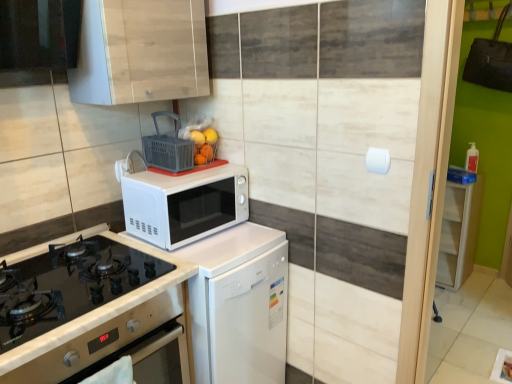
The height and width of the screenshot is (384, 512). Find the location of `plastic basket at upper center`. plastic basket at upper center is located at coordinates (168, 148).

What do you see at coordinates (68, 285) in the screenshot? The width and height of the screenshot is (512, 384). I see `black glass gas stove at lower left` at bounding box center [68, 285].

In order to face black glass exhaust hood at upper left, should I rotate leftwards or rightwards?

To align with it, rotate left about 28.054°.

Image resolution: width=512 pixels, height=384 pixels. What do you see at coordinates (37, 39) in the screenshot? I see `black glass exhaust hood at upper left` at bounding box center [37, 39].

The width and height of the screenshot is (512, 384). Describe the element at coordinates (140, 52) in the screenshot. I see `wooden cabinet at upper center, positioned as the 2th cabinetry in right-to-left order` at that location.

Measure the distance between wooden cabinet at upper center, which ranks as the second cabinetry in back-to-front order, and camera.

The depth of wooden cabinet at upper center, which ranks as the second cabinetry in back-to-front order, is 1.36 meters.

Where is `plastic basket at upper center`? This screenshot has height=384, width=512. plastic basket at upper center is located at coordinates (168, 148).

From a real-world perspective, which object stands above the other?

plastic basket at upper center.

Is white plastic electric outlet at upper center far away from plastic basket at upper center?

No, there isn't a large distance between white plastic electric outlet at upper center and plastic basket at upper center.

Can you tell me how much white plastic electric outlet at upper center and plastic basket at upper center differ in facing direction?

The angular difference between white plastic electric outlet at upper center and plastic basket at upper center is 4.36 degrees.

Can you confirm if white plastic electric outlet at upper center is wider than plastic basket at upper center?

No, white plastic electric outlet at upper center is not wider than plastic basket at upper center.

From a real-world perspective, which is physically below, wooden cabinet at upper center, which is the 2th cabinetry in bottom-to-top order, or white matte microwave at center?

white matte microwave at center.

Is white matte microwave at center surrounded by wooden cabinet at upper center, which ranks as the second cabinetry in back-to-front order?

No, white matte microwave at center is not inside wooden cabinet at upper center, which ranks as the second cabinetry in back-to-front order.

From the image's perspective, does wooden cabinet at upper center, which ranks as the first cabinetry in top-to-bottom order, appear lower than white matte microwave at center?

Incorrect, from the image's perspective, wooden cabinet at upper center, which ranks as the first cabinetry in top-to-bottom order, is higher than white matte microwave at center.

Based on their positions, is matte white oven at lower left located to the left or right of plastic basket at upper center?

From the image, it's evident that matte white oven at lower left is to the left of plastic basket at upper center.

Considering the positions of objects matte white oven at lower left and plastic basket at upper center in the image provided, who is behind, matte white oven at lower left or plastic basket at upper center?

Positioned behind is plastic basket at upper center.

You are a GUI agent. You are given a task and a screenshot of the screen. Output one action in this format:
    pyautogui.click(x=<x>, y=<y>)
    Task: Click on the oven located in front of the plastic basket at upper center
    
    Given the screenshot: What is the action you would take?
    pyautogui.click(x=99, y=340)

From a real-world perspective, is white plastic electric outlet at upper center positioned above or below white matte microwave at center?

white plastic electric outlet at upper center is situated higher than white matte microwave at center in the real world.

Is white plastic electric outlet at upper center not inside white matte microwave at center?

Indeed, white plastic electric outlet at upper center is completely outside white matte microwave at center.

Is white plastic electric outlet at upper center wider or thinner than white matte microwave at center?

In the image, white plastic electric outlet at upper center appears to be more narrow than white matte microwave at center.

Considering the points (124, 172) and (190, 197), which point is behind, point (124, 172) or point (190, 197)?

The point (124, 172) is more distant.

What's the angular difference between black glass gas stove at lower left and matte white oven at lower left's facing directions?

black glass gas stove at lower left and matte white oven at lower left are facing 0.386 degrees away from each other.

Who is smaller, black glass gas stove at lower left or matte white oven at lower left?

Smaller between the two is black glass gas stove at lower left.

You are a GUI agent. You are given a task and a screenshot of the screen. Output one action in this format:
    pyautogui.click(x=<x>, y=<y>)
    Task: Click on the gas stove above the matte white oven at lower left (from a real-world perspective)
    The image size is (512, 384).
    Given the screenshot: What is the action you would take?
    pyautogui.click(x=68, y=285)

Considering the relative sizes of black glass gas stove at lower left and matte white oven at lower left in the image provided, is black glass gas stove at lower left thinner than matte white oven at lower left?

No, black glass gas stove at lower left is not thinner than matte white oven at lower left.

Based on the photo, can you tell me how much black glass exhaust hood at upper left and wooden cabinet at upper center, which ranks as the 1th cabinetry in front-to-back order, differ in facing direction?

The angular difference between black glass exhaust hood at upper left and wooden cabinet at upper center, which ranks as the 1th cabinetry in front-to-back order, is 0.446 degrees.

Is point (24, 5) farther from viewer compared to point (104, 42)?

No, (24, 5) is closer to viewer.

This screenshot has width=512, height=384. Identify the location of the 1st cabinetry located beneath the black glass exhaust hood at upper left (from a real-world perspective). (140, 52).

Based on their sizes in the image, would you say black glass exhaust hood at upper left is bigger or smaller than wooden cabinet at upper center, which is the first cabinetry in left-to-right order?

In the image, black glass exhaust hood at upper left appears to be smaller than wooden cabinet at upper center, which is the first cabinetry in left-to-right order.

Is orange matte at upper center directly adjacent to white glossy dishwasher at center?

No, orange matte at upper center is not touching white glossy dishwasher at center.

Between orange matte at upper center and white glossy dishwasher at center, which one has more height?

white glossy dishwasher at center is taller.

Which object is positioned more to the left, orange matte at upper center or white glossy dishwasher at center?

Positioned to the left is orange matte at upper center.

From a real-world perspective, is orange matte at upper center under white glossy dishwasher at center?

No.

This screenshot has height=384, width=512. Identify the location of basket that is above the white plastic electric outlet at upper center (from a real-world perspective). (168, 148).

Find the location of a particular element. This screenshot has height=384, width=512. cabinetry in front of the white matte microwave at center is located at coordinates (140, 52).

From the picture: Based on their spatial positions, is white glossy dishwasher at center or white plastic electric outlet at upper center closer to white wood cabinet at right, arranged as the 1th cabinetry when ordered from the bottom?

Among the two, white glossy dishwasher at center is located nearer to white wood cabinet at right, arranged as the 1th cabinetry when ordered from the bottom.

From the image, which object appears to be nearer to black glass gas stove at lower left, orange matte at upper center or white glossy dishwasher at center?

white glossy dishwasher at center.

From the image, which object appears to be nearer to white matte microwave at center, white plastic electric outlet at upper center or white glossy dishwasher at center?

The object closer to white matte microwave at center is white glossy dishwasher at center.

Looking at the image, which one is located further to black glass exhaust hood at upper left, orange matte at upper center or wooden cabinet at upper center, which is the 2th cabinetry in bottom-to-top order?

The object further to black glass exhaust hood at upper left is orange matte at upper center.

From the image, which object appears to be farther from black glass gas stove at lower left, white glossy dishwasher at center or white plastic electric outlet at upper center?

white plastic electric outlet at upper center.

From the image, which object appears to be farther from white matte microwave at center, white glossy dishwasher at center or orange matte at upper center?

orange matte at upper center lies further to white matte microwave at center than the other object.

Considering their positions, is white glossy dishwasher at center positioned further to plastic basket at upper center than orange matte at upper center?

The object further to plastic basket at upper center is white glossy dishwasher at center.

Estimate the real-world distances between objects in this image. Which object is closer to white wood cabinet at right, which ranks as the first cabinetry in right-to-left order, white glossy dishwasher at center or black glass gas stove at lower left?

white glossy dishwasher at center.

The width and height of the screenshot is (512, 384). Identify the location of microwave oven between black glass exhaust hood at upper left and black glass gas stove at lower left from top to bottom. (184, 204).

This screenshot has width=512, height=384. In order to click on orange located between black glass gas stove at lower left and white wood cabinet at right, which ranks as the first cabinetry in right-to-left order, in the left-right direction in this screenshot , I will do `click(197, 138)`.

The image size is (512, 384). Identify the location of microwave oven between wooden cabinet at upper center, positioned as the 2th cabinetry in right-to-left order, and white glossy dishwasher at center from top to bottom. (184, 204).

Find the location of a particular element. This screenshot has width=512, height=384. basket between wooden cabinet at upper center, positioned as the 2th cabinetry in right-to-left order, and black glass gas stove at lower left in the up-down direction is located at coordinates (168, 148).